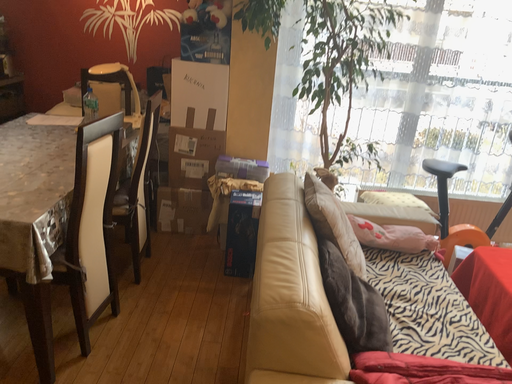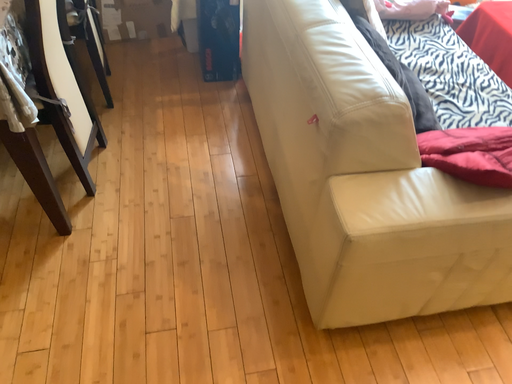
Question: How did the camera likely rotate when shooting the video?

Choices:
 (A) rotated right
 (B) rotated left

Answer: (A)